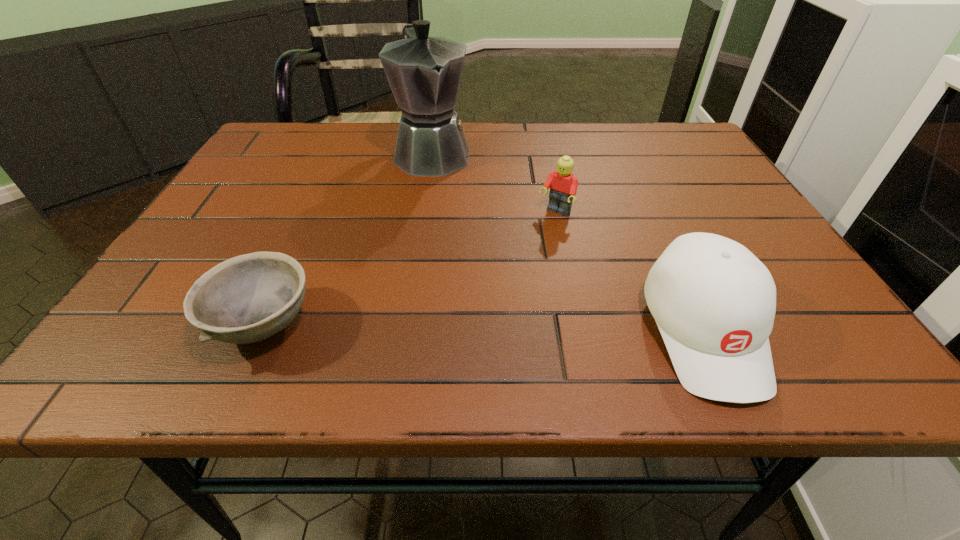
At what (x,y) coordinates should I click in order to perform the action: click on vacant space located on the face of the second farthest object. Please return your answer as a coordinate pair (x, y). This screenshot has width=960, height=540. Looking at the image, I should click on (536, 235).

At what (x,y) coordinates should I click in order to perform the action: click on vacant space situated 0.260m at the spout of the tallest object. Please return your answer as a coordinate pair (x, y). The width and height of the screenshot is (960, 540). Looking at the image, I should click on (477, 247).

Identify the location of free space located at the spout of the tallest object. This screenshot has width=960, height=540. (460, 213).

What are the coordinates of `vacant space located at the spout of the tallest object` in the screenshot? It's located at pos(447,191).

At what (x,y) coordinates should I click in order to perform the action: click on object that is positioned at the far edge. Please return your answer as a coordinate pair (x, y). Image resolution: width=960 pixels, height=540 pixels. Looking at the image, I should click on (424, 73).

Where is `bowl situated at the near edge`? This screenshot has height=540, width=960. bowl situated at the near edge is located at coordinates (x=248, y=298).

This screenshot has height=540, width=960. What are the coordinates of `baseball cap that is at the near edge` in the screenshot? It's located at (714, 302).

At what (x,y) coordinates should I click in order to perform the action: click on object present at the left edge. Please return your answer as a coordinate pair (x, y). Looking at the image, I should click on (248, 298).

Where is `object that is at the right edge`? This screenshot has height=540, width=960. object that is at the right edge is located at coordinates (714, 302).

The height and width of the screenshot is (540, 960). In order to click on object at the near left corner in this screenshot , I will do click(x=248, y=298).